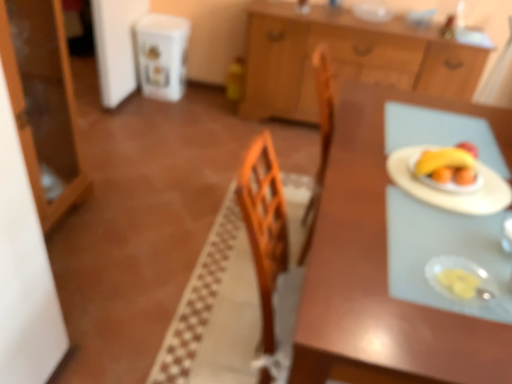
Identify the location of free point behind white paper plate at right. (423, 126).